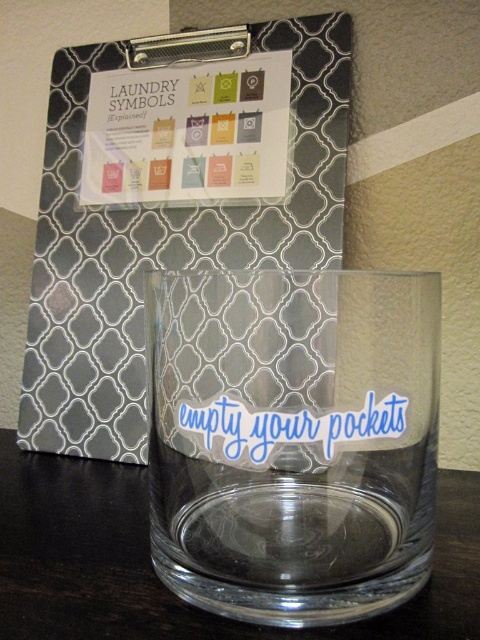
Does transparent plastic clipboard at upper left have a greater height compared to transparent glass at lower center?

Correct, transparent plastic clipboard at upper left is much taller as transparent glass at lower center.

Which is more to the left, transparent plastic clipboard at upper left or transparent glass at lower center?

transparent plastic clipboard at upper left

Does point (54, 68) come in front of point (7, 432)?

Yes, point (54, 68) is closer to viewer.

Where is `transparent plastic clipboard at upper left`? The width and height of the screenshot is (480, 640). transparent plastic clipboard at upper left is located at coordinates (160, 244).

Who is shorter, transparent glass at center or transparent glass at lower center?

transparent glass at lower center is shorter.

In the scene shown: Which is more to the right, transparent glass at center or transparent glass at lower center?

transparent glass at center

Who is more forward, (203, 378) or (8, 516)?

Point (203, 378) is more forward.

I want to click on transparent glass at center, so click(x=292, y=440).

Can you confirm if transparent glass at center is thinner than transparent plastic clipboard at upper left?

Yes, transparent glass at center is thinner than transparent plastic clipboard at upper left.

Who is higher up, transparent glass at center or transparent plastic clipboard at upper left?

transparent plastic clipboard at upper left is above.

The height and width of the screenshot is (640, 480). In order to click on transparent glass at center in this screenshot , I will do `click(292, 440)`.